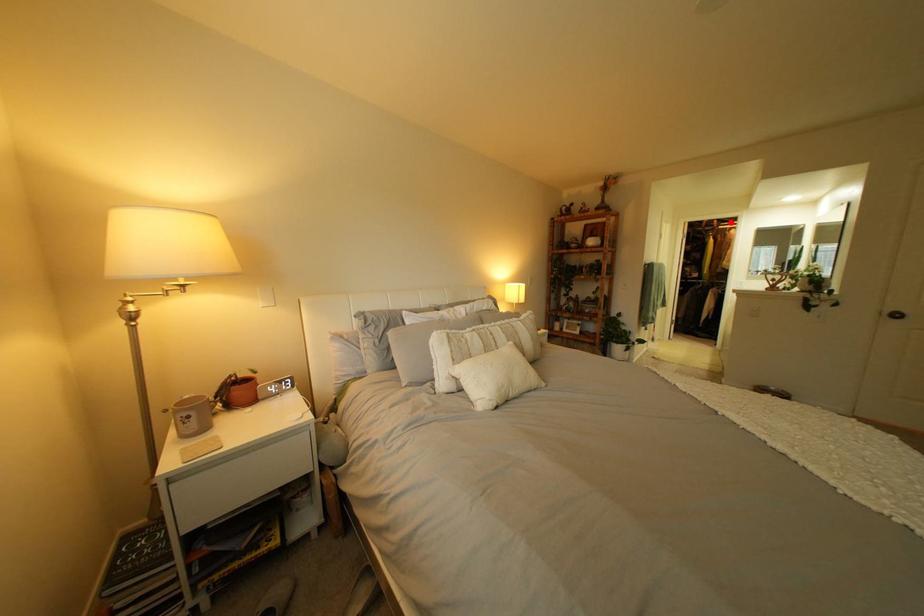
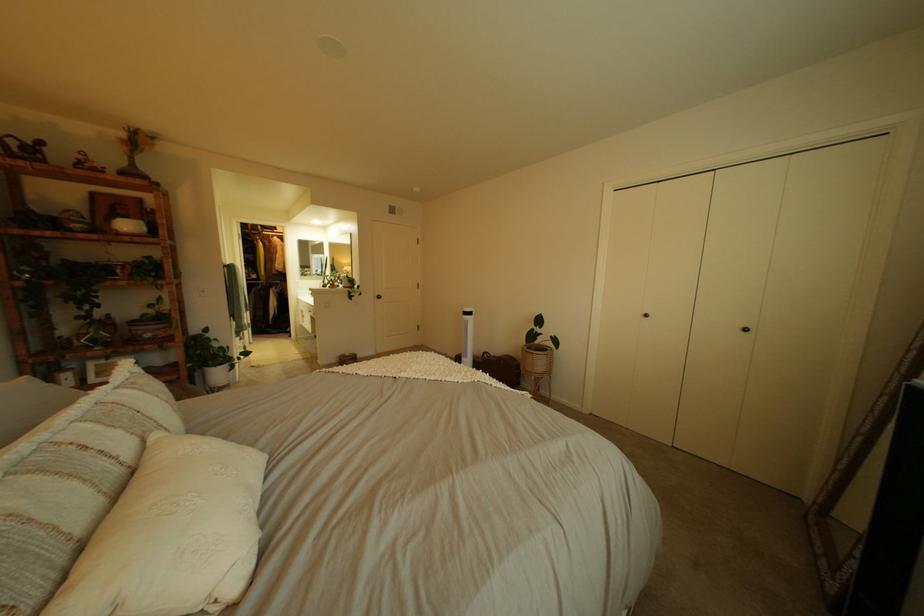
Find the pixel in the second image that matches the highlighted location in the first image.

(274, 228)